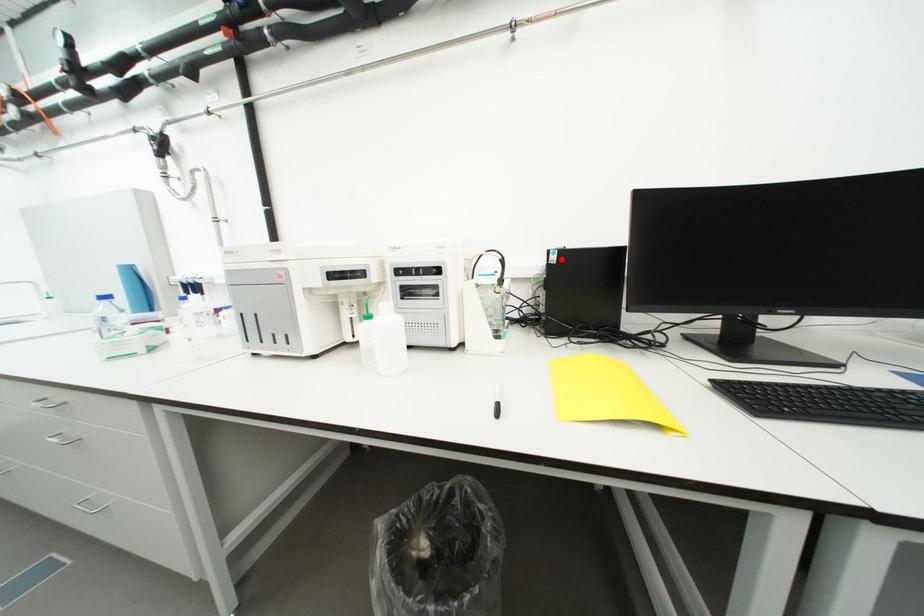
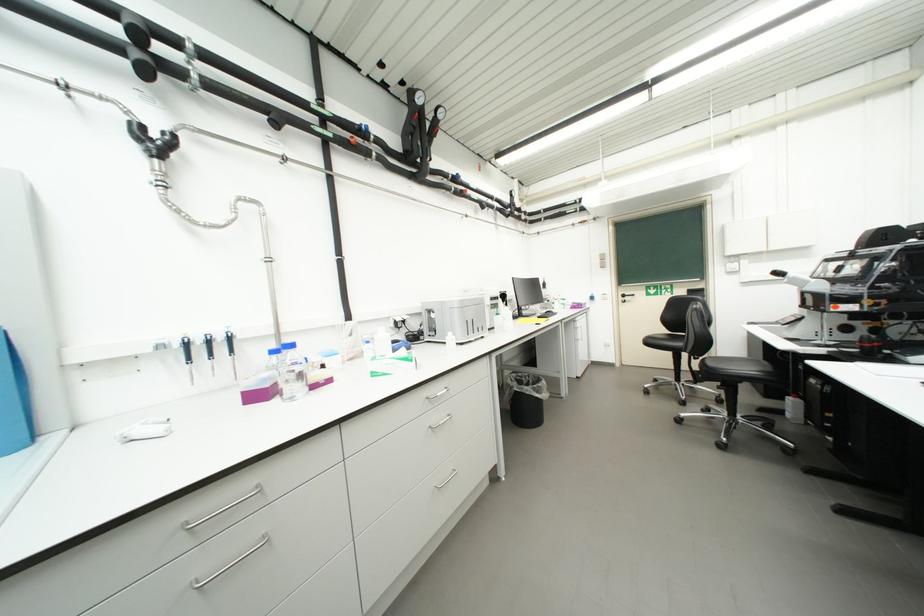
Question: I am providing you with two images of the same scene from different viewpoints. A red point is marked on the first image. Can you still see the location of the red point in image 2?

Choices:
 (A) Yes
 (B) No

Answer: (B)